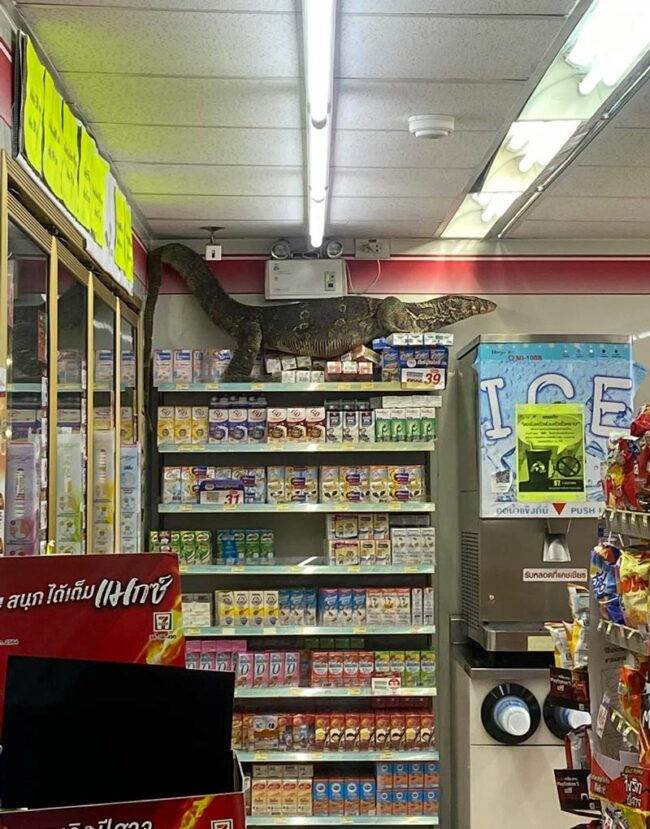
The width and height of the screenshot is (650, 829). I want to click on glass door, so click(28, 279), click(75, 307), click(107, 380), click(125, 447).